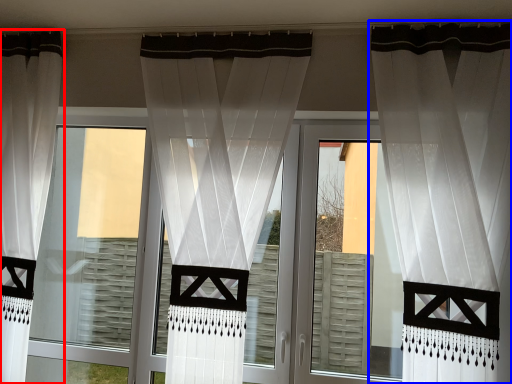
Question: Among these objects, which one is nearest to the camera, curtain (highlighted by a red box) or curtain (highlighted by a blue box)?

Choices:
 (A) curtain
 (B) curtain

Answer: (B)